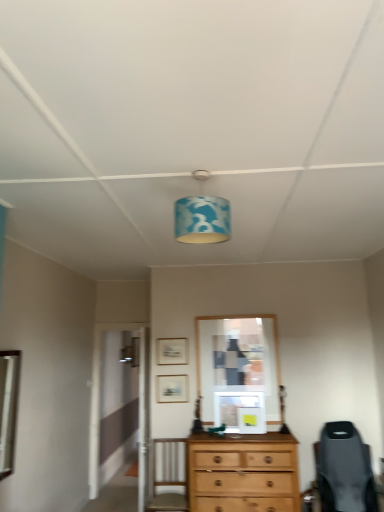
Question: In which direction should I rotate to look at matte gold picture frame at center, which is counted as the 2th picture frame, starting from the bottom?

Choices:
 (A) right
 (B) left

Answer: (B)

Question: Considering the relative sizes of silver metallic mirror at left and matte gold picture frame at center, the 2th picture frame when ordered from front to back, in the image provided, is silver metallic mirror at left shorter than matte gold picture frame at center, the 2th picture frame when ordered from front to back,?

Choices:
 (A) no
 (B) yes

Answer: (A)

Question: Is silver metallic mirror at left at the right side of matte gold picture frame at center, which is counted as the 2th picture frame, starting from the bottom?

Choices:
 (A) yes
 (B) no

Answer: (B)

Question: Is silver metallic mirror at left thinner than matte gold picture frame at center, the first picture frame from the top?

Choices:
 (A) no
 (B) yes

Answer: (A)

Question: From a real-world perspective, is silver metallic mirror at left on matte gold picture frame at center, the 2th picture frame when ordered from front to back?

Choices:
 (A) no
 (B) yes

Answer: (A)

Question: Does silver metallic mirror at left have a larger size compared to matte gold picture frame at center, the 2th picture frame when ordered from front to back?

Choices:
 (A) no
 (B) yes

Answer: (B)

Question: Does silver metallic mirror at left contain matte gold picture frame at center, the 2th picture frame when ordered from front to back?

Choices:
 (A) yes
 (B) no

Answer: (B)

Question: Is matte gold picture frame at center, which is counted as the 2th picture frame, starting from the bottom, thinner than matte wooden picture frame at center, which is the first picture frame in bottom-to-top order?

Choices:
 (A) no
 (B) yes

Answer: (B)

Question: Can you confirm if matte gold picture frame at center, which is counted as the 2th picture frame, starting from the bottom, is smaller than matte wooden picture frame at center, which appears as the 2th picture frame when viewed from the back?

Choices:
 (A) no
 (B) yes

Answer: (B)

Question: Does matte gold picture frame at center, the 2th picture frame when ordered from front to back, appear on the left side of matte wooden picture frame at center, which is the first picture frame in bottom-to-top order?

Choices:
 (A) no
 (B) yes

Answer: (A)

Question: Considering the relative positions of matte gold picture frame at center, which is the first picture frame in back-to-front order, and matte wooden picture frame at center, which is the first picture frame in bottom-to-top order, in the image provided, is matte gold picture frame at center, which is the first picture frame in back-to-front order, in front of matte wooden picture frame at center, which is the first picture frame in bottom-to-top order,?

Choices:
 (A) yes
 (B) no

Answer: (B)

Question: Considering the relative sizes of matte gold picture frame at center, which is the first picture frame in back-to-front order, and matte wooden picture frame at center, which is counted as the 2th picture frame, starting from the top, in the image provided, is matte gold picture frame at center, which is the first picture frame in back-to-front order, bigger than matte wooden picture frame at center, which is counted as the 2th picture frame, starting from the top,?

Choices:
 (A) yes
 (B) no

Answer: (B)

Question: Can you confirm if matte gold picture frame at center, which is the first picture frame in back-to-front order, is taller than matte wooden picture frame at center, which is counted as the 2th picture frame, starting from the top?

Choices:
 (A) yes
 (B) no

Answer: (B)

Question: Is the depth of matte wooden picture frame at center, which is counted as the 2th picture frame, starting from the top, greater than that of silver metallic mirror at left?

Choices:
 (A) yes
 (B) no

Answer: (A)